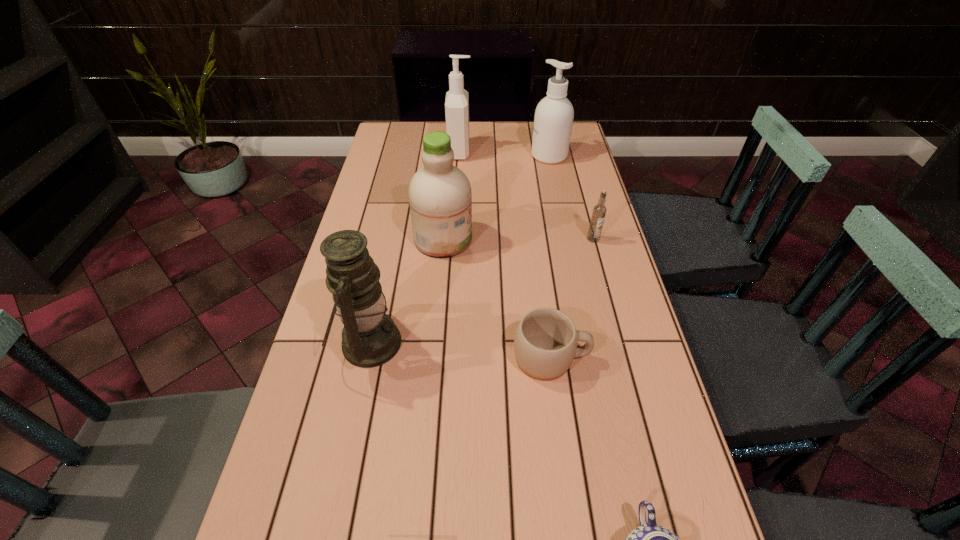
In order to click on the rightmost cleansing agent in this screenshot , I will do `click(554, 114)`.

Image resolution: width=960 pixels, height=540 pixels. Identify the location of the nearest cleansing agent. (440, 197).

Find the location of `oil lamp`. oil lamp is located at coordinates (370, 338).

At what (x,y) coordinates should I click in order to perform the action: click on the third shortest object. Please return your answer as a coordinate pair (x, y). The height and width of the screenshot is (540, 960). Looking at the image, I should click on (599, 211).

The height and width of the screenshot is (540, 960). Find the location of `mug`. mug is located at coordinates (545, 343).

I want to click on vacant space located on the front label of the rightmost cleansing agent, so click(x=429, y=156).

The width and height of the screenshot is (960, 540). In order to click on free space located 0.050m on the front label of the rightmost cleansing agent in this screenshot , I will do `click(517, 156)`.

This screenshot has height=540, width=960. Find the location of `vacant region located on the front label of the rightmost cleansing agent`. vacant region located on the front label of the rightmost cleansing agent is located at coordinates (480, 156).

Locate an element on the screen. The image size is (960, 540). free space located on the front label of the nearest cleansing agent is located at coordinates (496, 239).

The width and height of the screenshot is (960, 540). In order to click on free space located on the front of the oil lamp in this screenshot , I will do `click(331, 516)`.